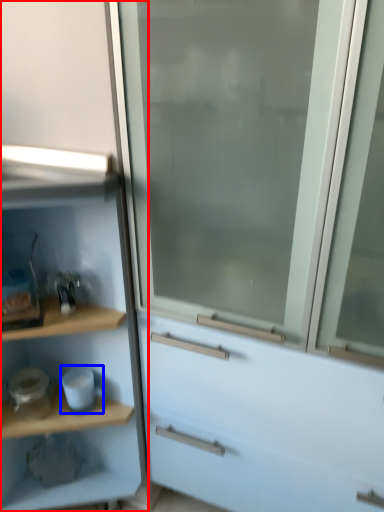
Question: Which object is closer to the camera taking this photo, cupboard (highlighted by a red box) or appliance (highlighted by a blue box)?

Choices:
 (A) cupboard
 (B) appliance

Answer: (A)